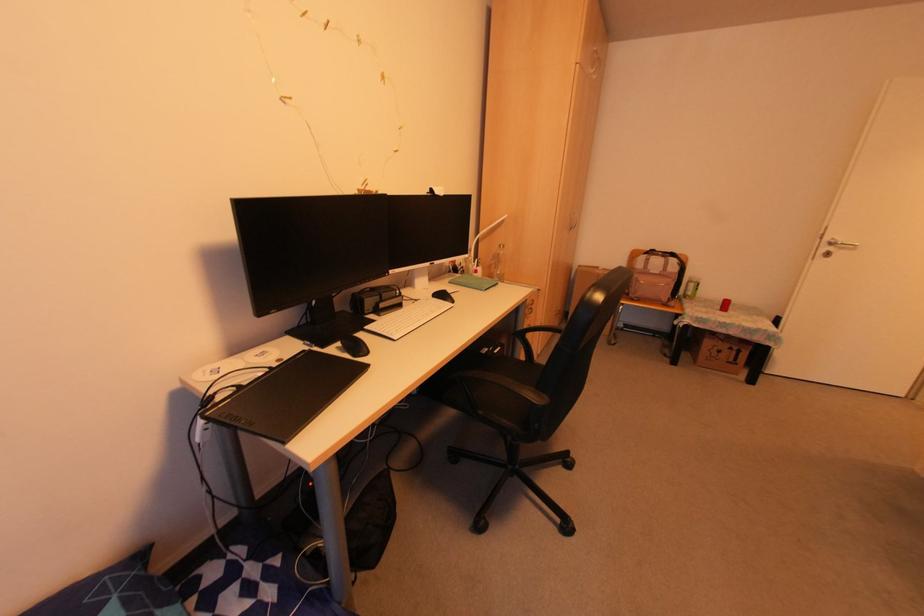
Find the location of a particular element. This screenshot has height=616, width=924. wooden cabinet handle is located at coordinates (573, 220).